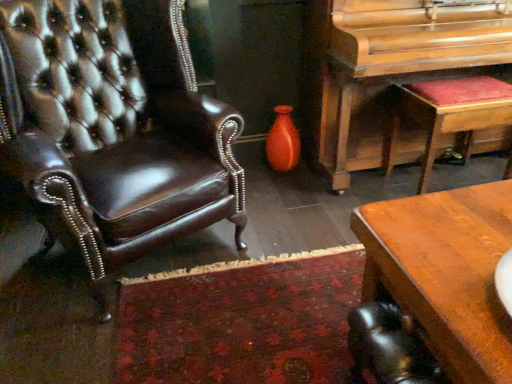
Question: Does brown leather chair at left have a smaller size compared to brown wooden desk at lower right?

Choices:
 (A) yes
 (B) no

Answer: (B)

Question: Can you confirm if brown leather chair at left is shorter than brown wooden desk at lower right?

Choices:
 (A) no
 (B) yes

Answer: (A)

Question: Is brown leather chair at left outside brown wooden desk at lower right?

Choices:
 (A) yes
 (B) no

Answer: (A)

Question: Is brown wooden desk at lower right completely or partially inside brown leather chair at left?

Choices:
 (A) yes
 (B) no

Answer: (B)

Question: Can you confirm if brown leather chair at left is taller than brown wooden desk at lower right?

Choices:
 (A) no
 (B) yes

Answer: (B)

Question: Can you confirm if brown leather chair at left is positioned to the left of brown wooden desk at lower right?

Choices:
 (A) yes
 (B) no

Answer: (A)

Question: Does wooden polished piano at right have a smaller size compared to velvet red stool at right?

Choices:
 (A) yes
 (B) no

Answer: (B)

Question: From the image's perspective, is wooden polished piano at right under velvet red stool at right?

Choices:
 (A) no
 (B) yes

Answer: (A)

Question: From a real-world perspective, is wooden polished piano at right positioned over velvet red stool at right based on gravity?

Choices:
 (A) yes
 (B) no

Answer: (A)

Question: From the image's perspective, is wooden polished piano at right on velvet red stool at right?

Choices:
 (A) yes
 (B) no

Answer: (A)

Question: Is wooden polished piano at right behind velvet red stool at right?

Choices:
 (A) no
 (B) yes

Answer: (A)

Question: Can you confirm if wooden polished piano at right is bigger than velvet red stool at right?

Choices:
 (A) no
 (B) yes

Answer: (B)

Question: Would you say matte orange vase at center contains velvet red stool at right?

Choices:
 (A) no
 (B) yes

Answer: (A)